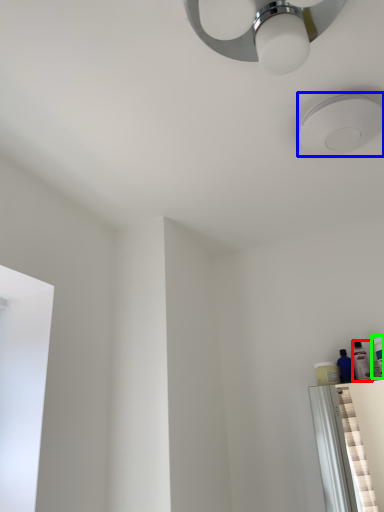
Question: Which object is positioned closest to toiletry (highlighted by a red box)? Select from droplight (highlighted by a blue box) and toiletry (highlighted by a green box).

Choices:
 (A) droplight
 (B) toiletry

Answer: (B)